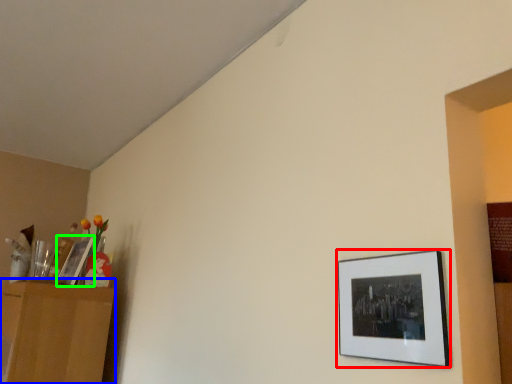
Question: Estimate the real-world distances between objects in this image. Which object is farther from picture frame (highlighted by a red box), dresser (highlighted by a blue box) or picture frame (highlighted by a green box)?

Choices:
 (A) dresser
 (B) picture frame

Answer: (B)